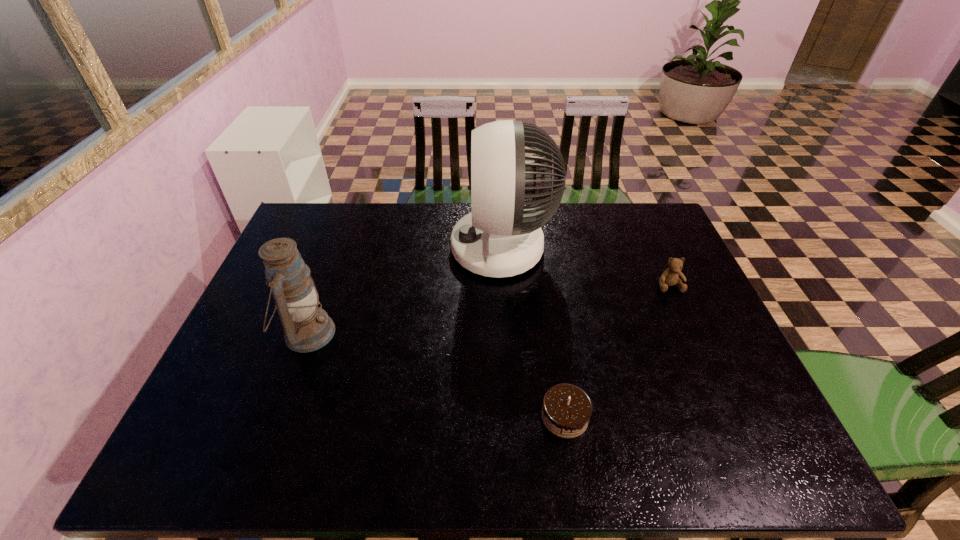
The width and height of the screenshot is (960, 540). I want to click on vacant point located between the nearest object and the leftmost object, so click(436, 375).

At what (x,y) coordinates should I click in order to perform the action: click on vacant region between the rightmost object and the fan. Please return your answer as a coordinate pair (x, y). The width and height of the screenshot is (960, 540). Looking at the image, I should click on (586, 267).

The image size is (960, 540). I want to click on object that is the nearest to the chocolate cake, so click(x=501, y=237).

Identify which object is the second nearest to the nearest object. Please provide its 2D coordinates. Your answer should be formatted as a tuple, i.e. [(x, y)], where the tuple contains the x and y coordinates of a point satisfying the conditions above.

[(670, 277)]

You are a GUI agent. You are given a task and a screenshot of the screen. Output one action in this format:
    pyautogui.click(x=<x>, y=<y>)
    Task: Click on the vacant point that satisfies the following two spatial constraints: 1. on the grille of the chocolate cake; 2. on the right side of the fan
    The image size is (960, 540).
    Given the screenshot: What is the action you would take?
    pyautogui.click(x=512, y=416)

Find the location of a particular element. vacant space that satisfies the following two spatial constraints: 1. on the grille of the nearest object; 2. on the left side of the tallest object is located at coordinates (512, 416).

Image resolution: width=960 pixels, height=540 pixels. Find the location of `free point that satisfies the following two spatial constraints: 1. on the grille of the tallest object; 2. on the back side of the nearest object`. free point that satisfies the following two spatial constraints: 1. on the grille of the tallest object; 2. on the back side of the nearest object is located at coordinates click(x=512, y=416).